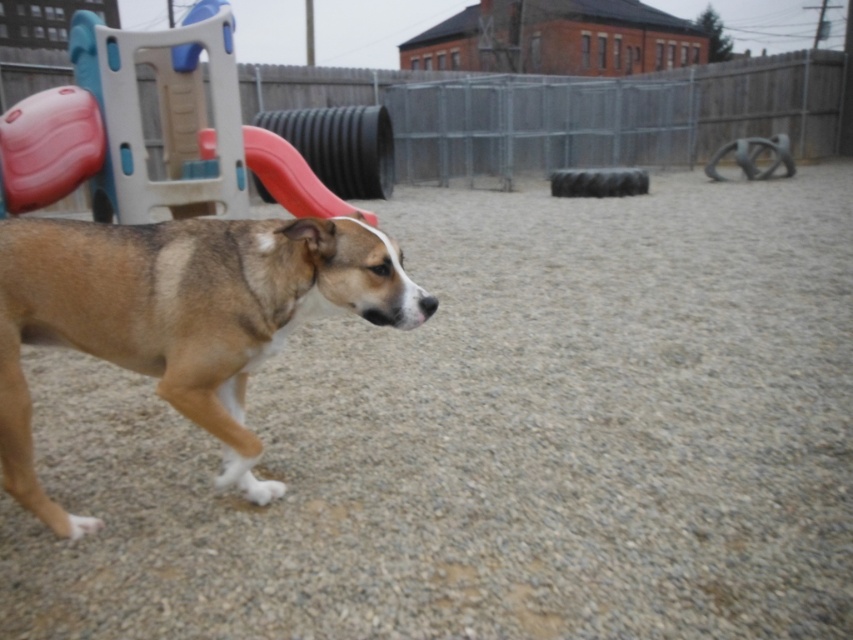
Where is the brown fur dog at center located in the image?

The brown fur dog at center is located at the 2D coordinates point (181,316) in the image.

You are a dog owner trying to decide if your brown fur dog at center can jump onto the matte plastic slide at upper left. Based on their heights, can your dog reach the top of the slide?

The brown fur dog at center is shorter than the matte plastic slide at upper left, so it may struggle to reach the top unless it has exceptional jumping ability.